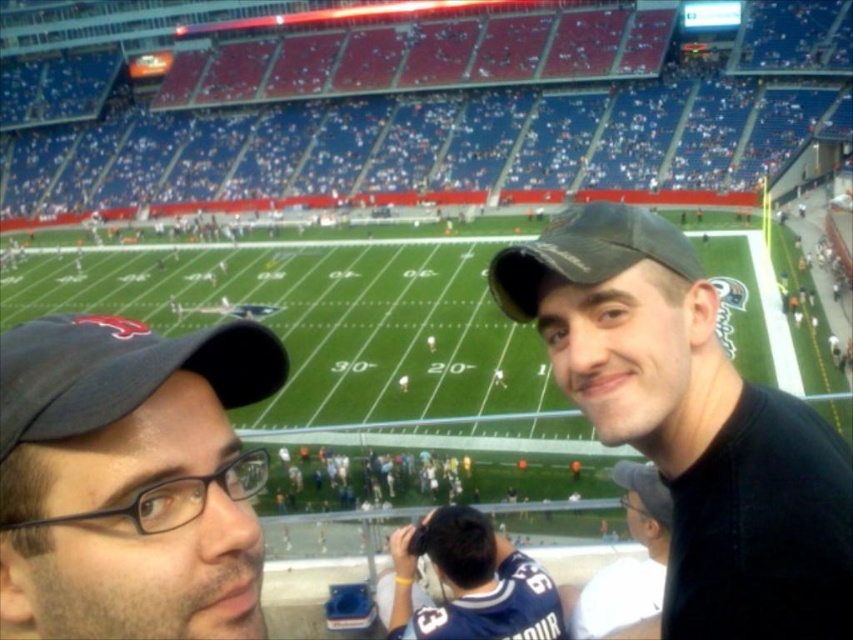
Is black matte baseball cap at right smaller than white matte cap at upper right?

Actually, black matte baseball cap at right might be larger than white matte cap at upper right.

Does black matte baseball cap at right have a lesser width compared to white matte cap at upper right?

In fact, black matte baseball cap at right might be wider than white matte cap at upper right.

Where is `black matte baseball cap at right`? black matte baseball cap at right is located at coordinates 585,253.

Is point (662, 436) in front of point (622, 234)?

No.

Between black matte cap at upper right and black matte baseball cap at right, which one has more height?

black matte baseball cap at right

Identify the location of black matte cap at upper right. (691, 424).

Where is `black matte cap at upper right`? The image size is (853, 640). black matte cap at upper right is located at coordinates (691, 424).

Does matte black baseball cap at left appear on the left side of black matte baseball cap at right?

Indeed, matte black baseball cap at left is positioned on the left side of black matte baseball cap at right.

Is matte black baseball cap at left bigger than black matte baseball cap at right?

No, matte black baseball cap at left is not bigger than black matte baseball cap at right.

Locate an element on the screen. The height and width of the screenshot is (640, 853). matte black baseball cap at left is located at coordinates (120, 371).